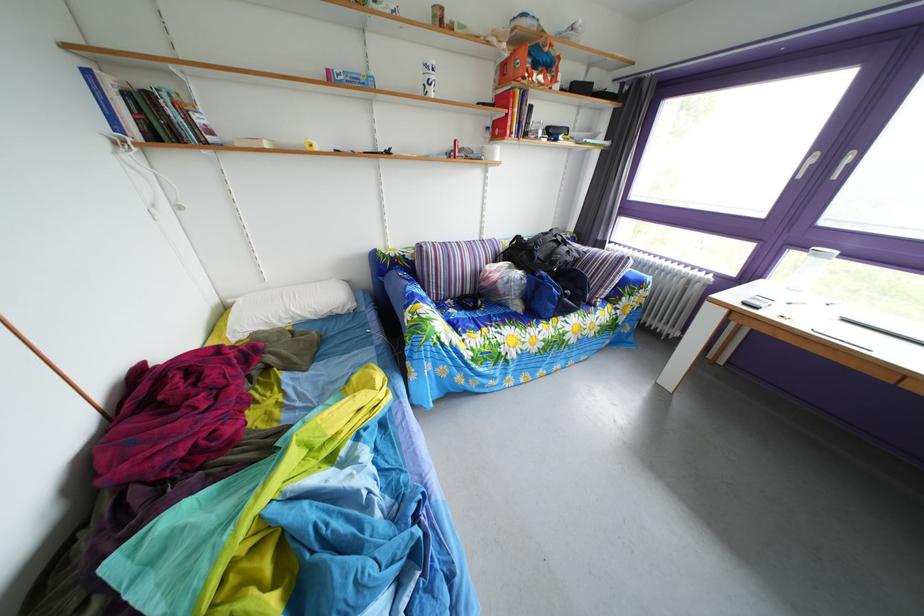
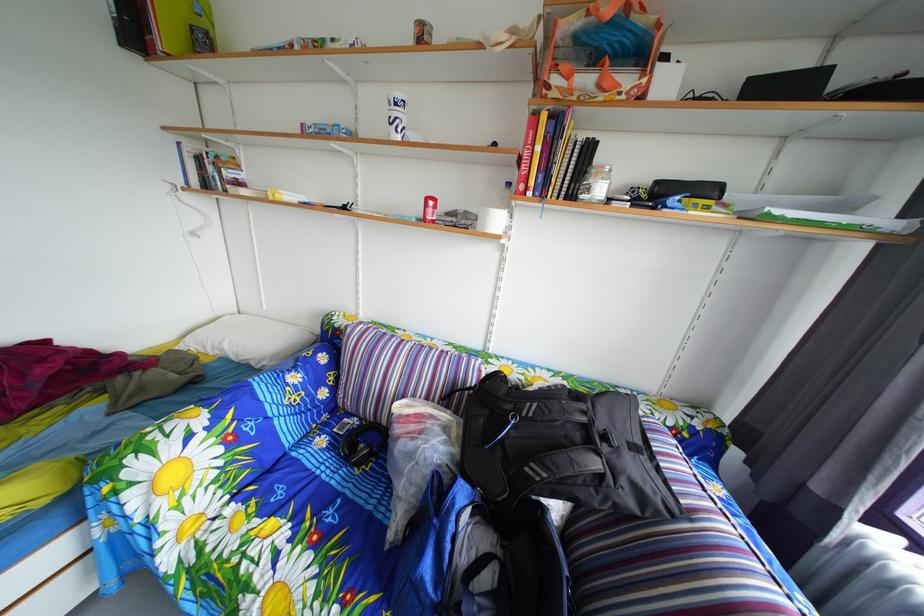
In the second image, find the point that corresponds to pixel 292 329 in the first image.

(224, 357)